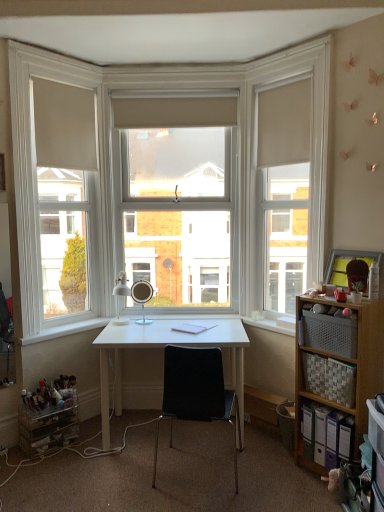
Identify the location of free point to the left of black plastic chair at center. pos(105,477).